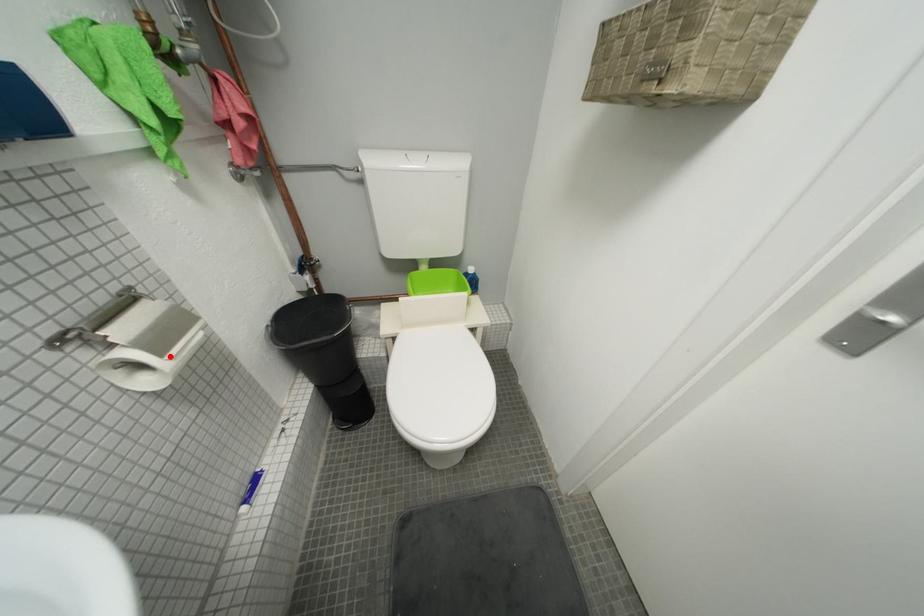
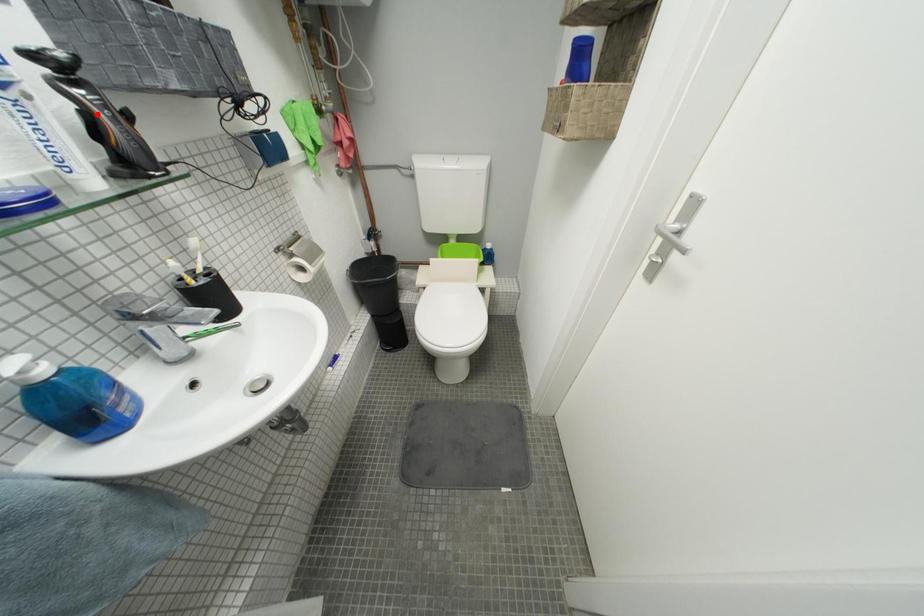
I am providing you with two images of the same scene from different viewpoints. A red point is marked on the first image and another point is marked on the second image. Is the red point in image1 aligned with the point shown in image2?

No